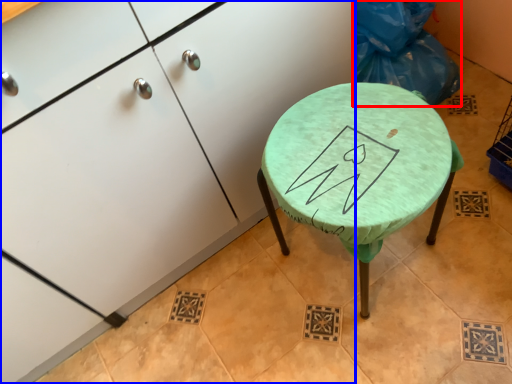
Question: Among these objects, which one is farthest to the camera, garbage (highlighted by a red box) or cabinetry (highlighted by a blue box)?

Choices:
 (A) garbage
 (B) cabinetry

Answer: (A)